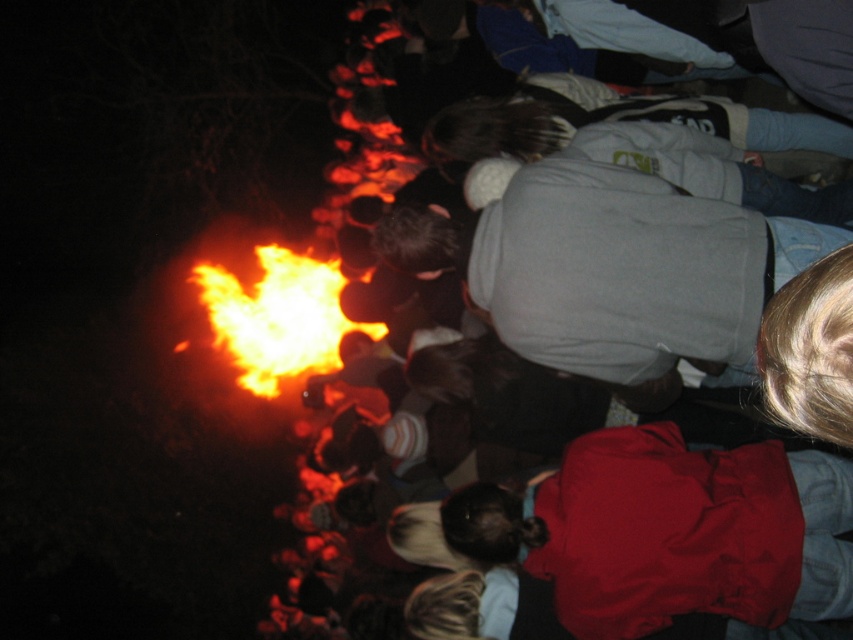
Question: Estimate the real-world distances between objects in this image. Which object is farther from the flamematerial/texture at center?

Choices:
 (A) matte red jacket at lower right
 (B) matte gray sweater at center

Answer: (A)

Question: Does matte red jacket at lower right have a greater width compared to matte gray sweater at center?

Choices:
 (A) yes
 (B) no

Answer: (A)

Question: Estimate the real-world distances between objects in this image. Which object is closer to the matte gray sweater at center?

Choices:
 (A) flamematerial/texture at center
 (B) matte red jacket at lower right

Answer: (A)

Question: Is matte red jacket at lower right wider than flamematerial/texture at center?

Choices:
 (A) yes
 (B) no

Answer: (A)

Question: Does matte red jacket at lower right have a smaller size compared to matte gray sweater at center?

Choices:
 (A) yes
 (B) no

Answer: (A)

Question: Estimate the real-world distances between objects in this image. Which object is farther from the matte gray sweater at center?

Choices:
 (A) flamematerial/texture at center
 (B) matte red jacket at lower right

Answer: (B)